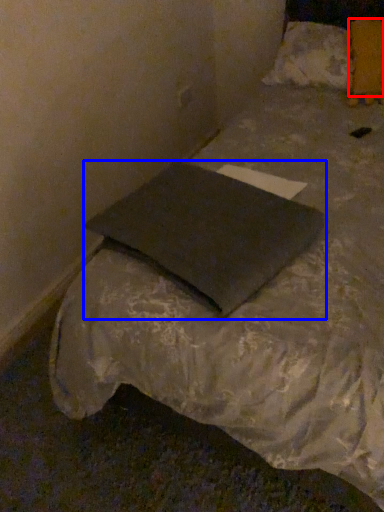
Question: Which object appears closest to the camera in this image, pillow (highlighted by a red box) or pillow (highlighted by a blue box)?

Choices:
 (A) pillow
 (B) pillow

Answer: (B)